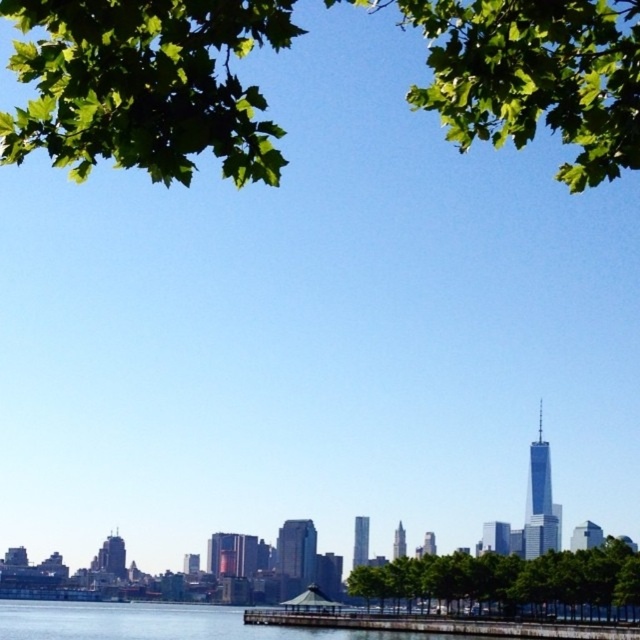
Question: Is green leafy tree at upper center to the right of green leafy tree at center from the viewer's perspective?

Choices:
 (A) no
 (B) yes

Answer: (A)

Question: Can you confirm if green leafy tree at upper center is positioned to the left of green leafy tree at center?

Choices:
 (A) yes
 (B) no

Answer: (A)

Question: Which object is farther from the camera taking this photo?

Choices:
 (A) green leafy tree at upper center
 (B) green leafy tree at center

Answer: (A)

Question: Is the position of green leafy tree at upper center more distant than that of green leafy tree at center?

Choices:
 (A) yes
 (B) no

Answer: (A)